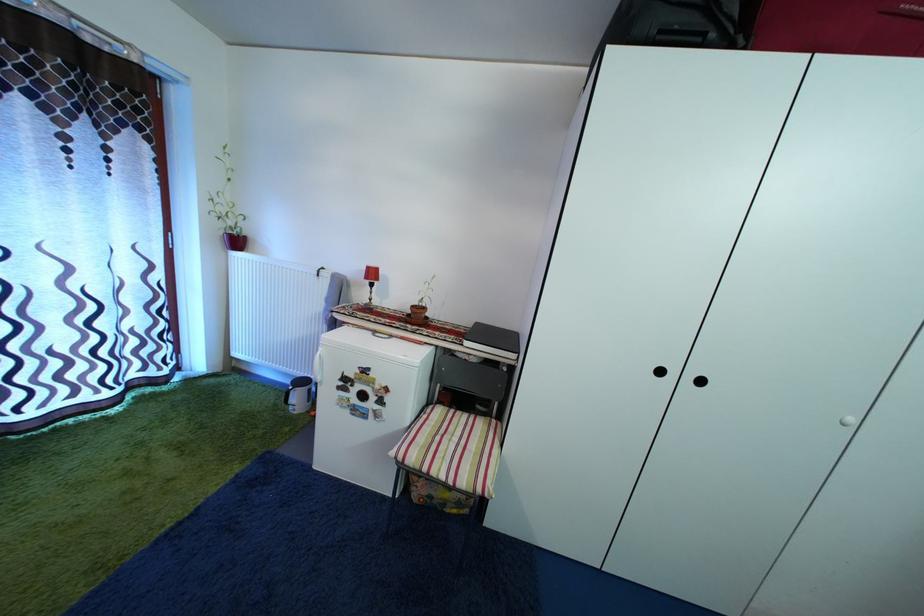
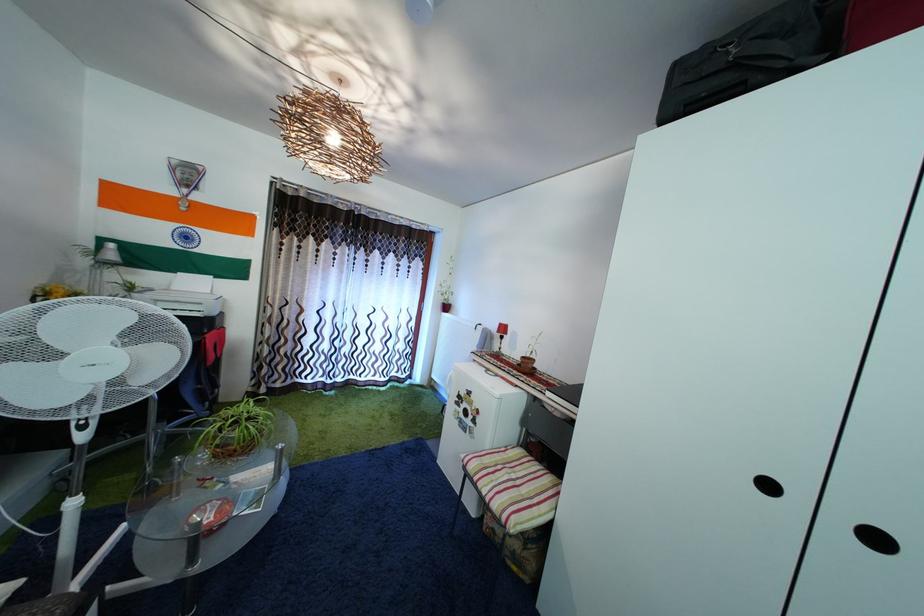
In the second image, find the point that corresponds to pixel 357 293 in the first image.

(500, 345)